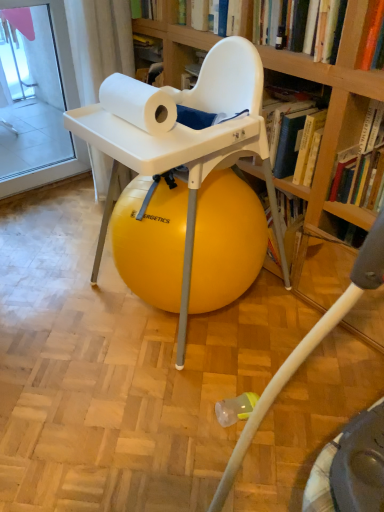
Question: Considering their positions, is yellow rubber ball at center located in front of or behind hardcover book at upper right, which is the second book in top-to-bottom order?

Choices:
 (A) front
 (B) behind

Answer: (A)

Question: Looking at the image, does yellow rubber ball at center seem bigger or smaller compared to hardcover book at upper right, which appears as the second book when viewed from the left?

Choices:
 (A) big
 (B) small

Answer: (A)

Question: Estimate the real-world distances between objects in this image. Which object is farther from the hardcover book at upper right, acting as the 1th book starting from the right?

Choices:
 (A) yellow rubber ball at center
 (B) white matte paper towel at upper center
 (C) hardcover book at upper center, the 2th book positioned from the bottom

Answer: (B)

Question: Estimate the real-world distances between objects in this image. Which object is closer to the yellow rubber ball at center?

Choices:
 (A) hardcover book at upper center, marked as the 1th book in a top-to-bottom arrangement
 (B) hardcover book at upper right, which appears as the second book when viewed from the left
 (C) white matte paper towel at upper center

Answer: (C)